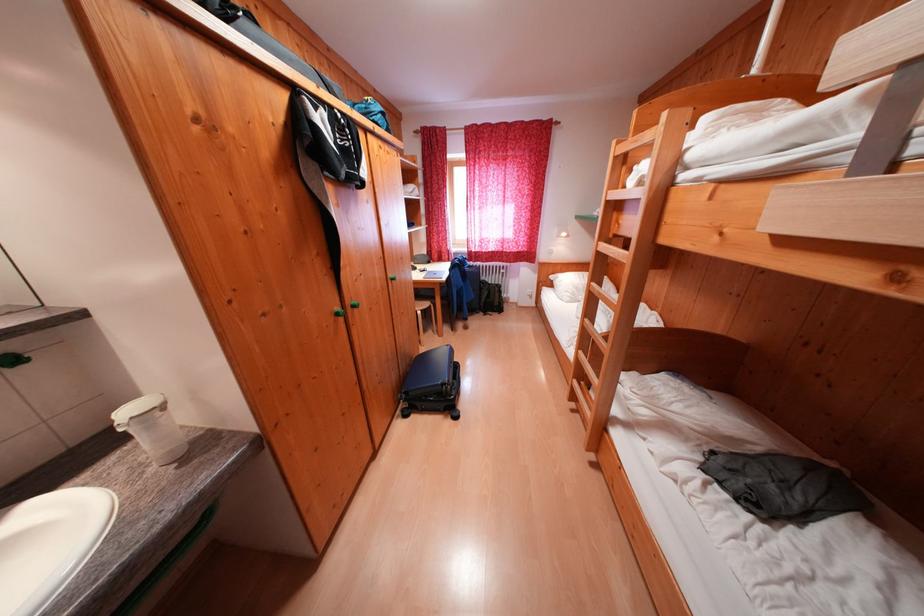
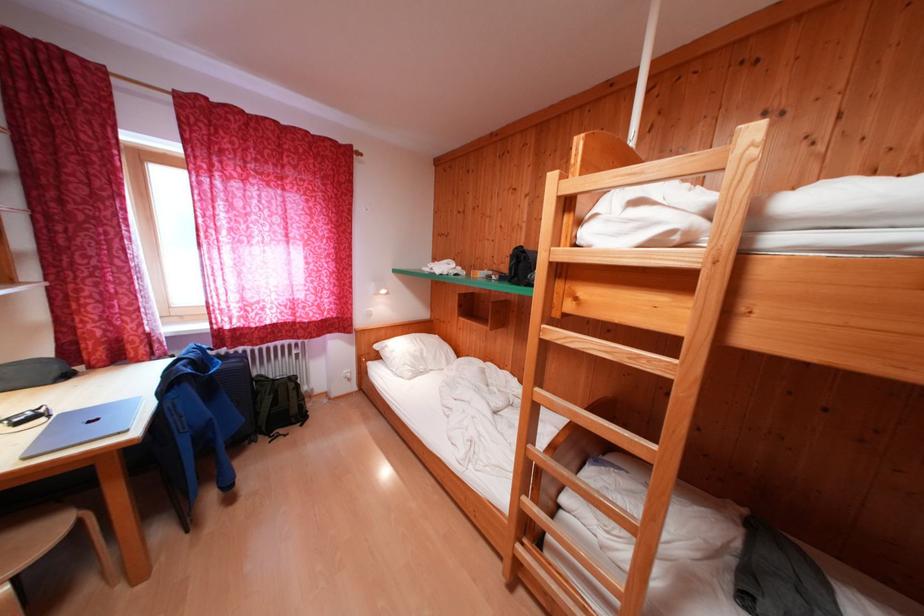
In the second image, find the point that corresponds to (x=560, y=289) in the first image.

(385, 361)